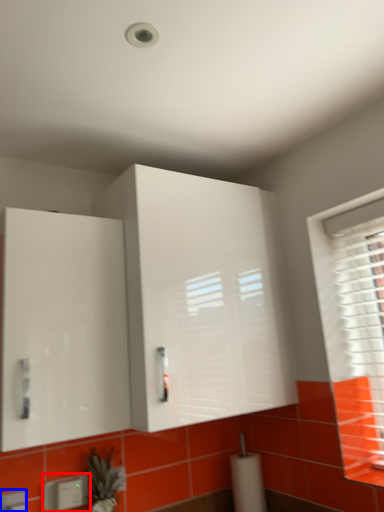
Question: Which of the following is the farthest to the observer, electric outlet (highlighted by a red box) or electric outlet (highlighted by a blue box)?

Choices:
 (A) electric outlet
 (B) electric outlet

Answer: (A)